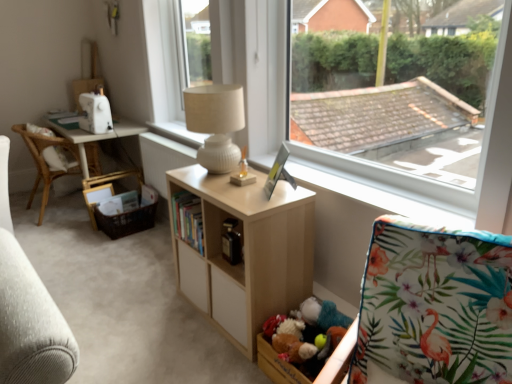
Question: Is light wood shelf at center wider than white wood table at left?

Choices:
 (A) no
 (B) yes

Answer: (A)

Question: Considering the relative sizes of light wood shelf at center and white wood table at left in the image provided, is light wood shelf at center taller than white wood table at left?

Choices:
 (A) yes
 (B) no

Answer: (A)

Question: Considering the relative positions of light wood shelf at center and white wood table at left in the image provided, is light wood shelf at center to the right of white wood table at left from the viewer's perspective?

Choices:
 (A) no
 (B) yes

Answer: (B)

Question: From the image's perspective, would you say light wood shelf at center is positioned over white wood table at left?

Choices:
 (A) no
 (B) yes

Answer: (A)

Question: Is light wood shelf at center further to the viewer compared to white wood table at left?

Choices:
 (A) no
 (B) yes

Answer: (A)

Question: Is light wood shelf at center with white wood table at left?

Choices:
 (A) yes
 (B) no

Answer: (B)

Question: Considering the relative sizes of light wood shelf at center and wooden toy box at lower center in the image provided, is light wood shelf at center taller than wooden toy box at lower center?

Choices:
 (A) no
 (B) yes

Answer: (B)

Question: Is wooden toy box at lower center a part of light wood shelf at center?

Choices:
 (A) no
 (B) yes

Answer: (A)

Question: From the image's perspective, is light wood shelf at center located beneath wooden toy box at lower center?

Choices:
 (A) yes
 (B) no

Answer: (B)

Question: Is light wood shelf at center outside wooden toy box at lower center?

Choices:
 (A) no
 (B) yes

Answer: (B)

Question: Considering the relative positions of light wood shelf at center and wooden toy box at lower center in the image provided, is light wood shelf at center behind wooden toy box at lower center?

Choices:
 (A) no
 (B) yes

Answer: (B)

Question: Is light wood shelf at center facing away from wooden toy box at lower center?

Choices:
 (A) yes
 (B) no

Answer: (B)

Question: Would you say light wood shelf at center is outside floral fabric rocking chair at lower right?

Choices:
 (A) yes
 (B) no

Answer: (A)